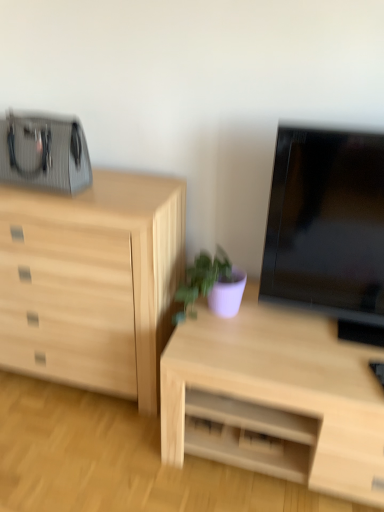
Question: In the image, is purple matte plant at center positioned in front of or behind light wood desk at center?

Choices:
 (A) behind
 (B) front

Answer: (A)

Question: Is purple matte plant at center taller or shorter than light wood desk at center?

Choices:
 (A) tall
 (B) short

Answer: (B)

Question: Which object is the closest to the black glossy tv at right?

Choices:
 (A) light wood desk at center
 (B) purple matte plant at center
 (C) natural wood chest of drawers at left

Answer: (A)

Question: Based on their relative distances, which object is nearer to the natural wood chest of drawers at left?

Choices:
 (A) purple matte plant at center
 (B) black glossy tv at right
 (C) light wood desk at center

Answer: (A)